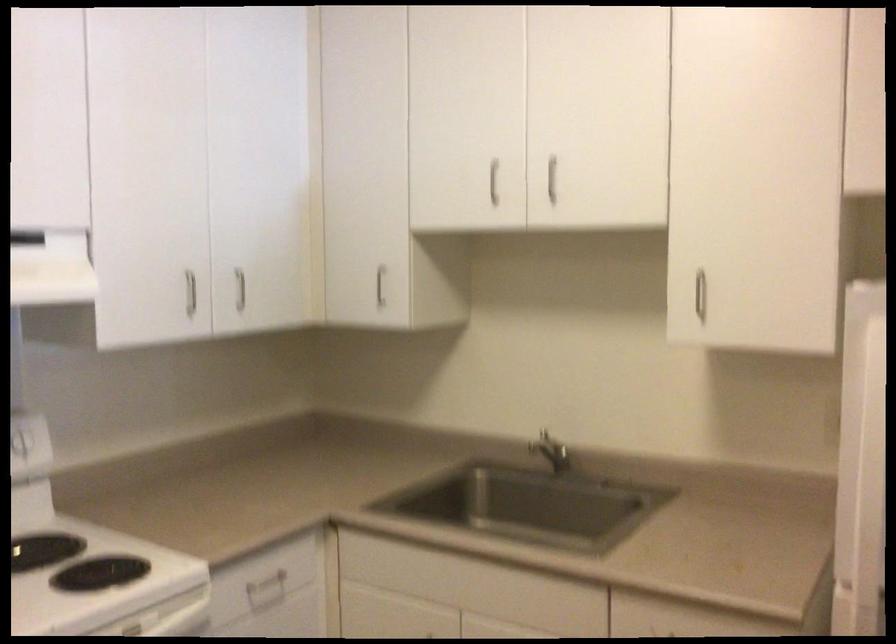
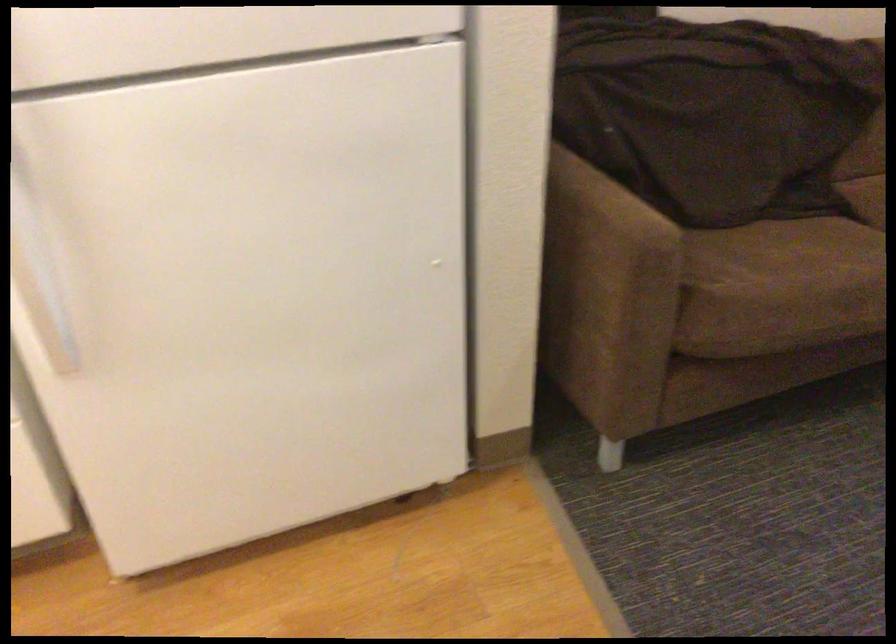
The first image is from the beginning of the video and the second image is from the end. How did the camera likely rotate when shooting the video?

The rotation direction of the camera is right-down.